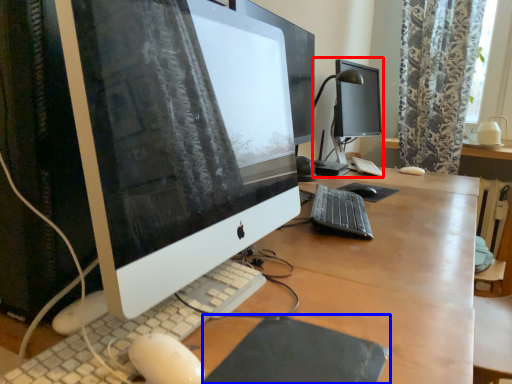
Question: Which of the following is the closest to the observer, desktop computer (highlighted by a red box) or mousepad (highlighted by a blue box)?

Choices:
 (A) desktop computer
 (B) mousepad

Answer: (B)